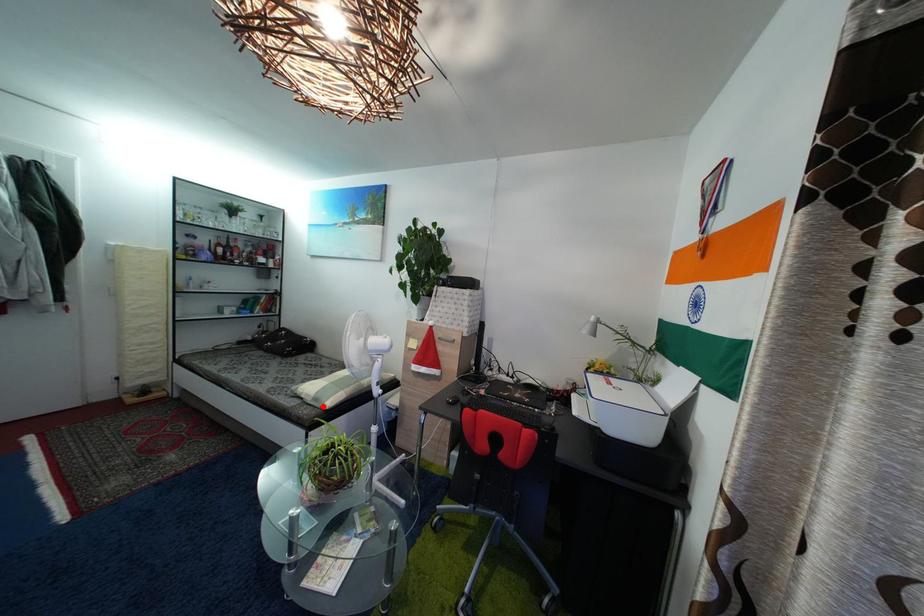
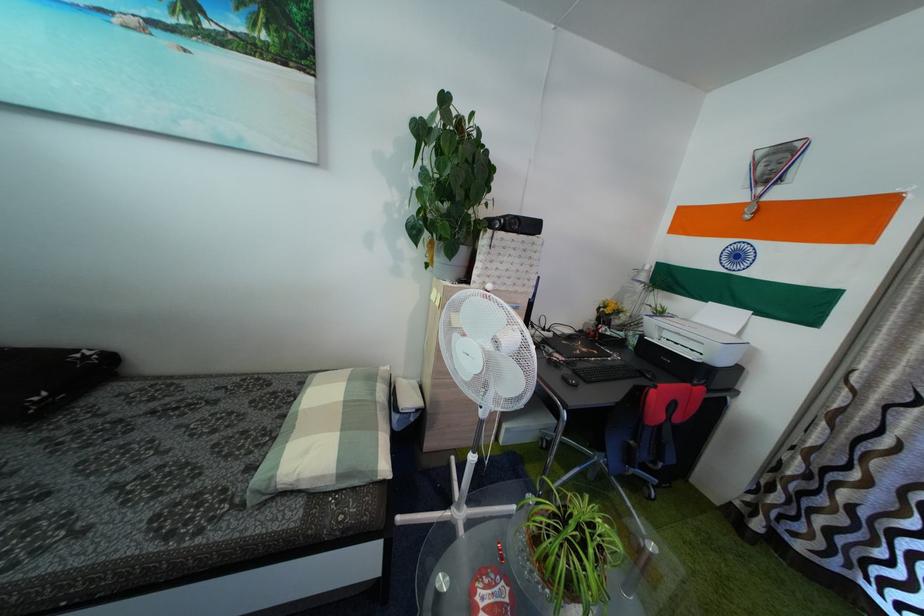
The point at the highlighted location is marked in the first image. Where is the corresponding point in the second image?

(347, 483)